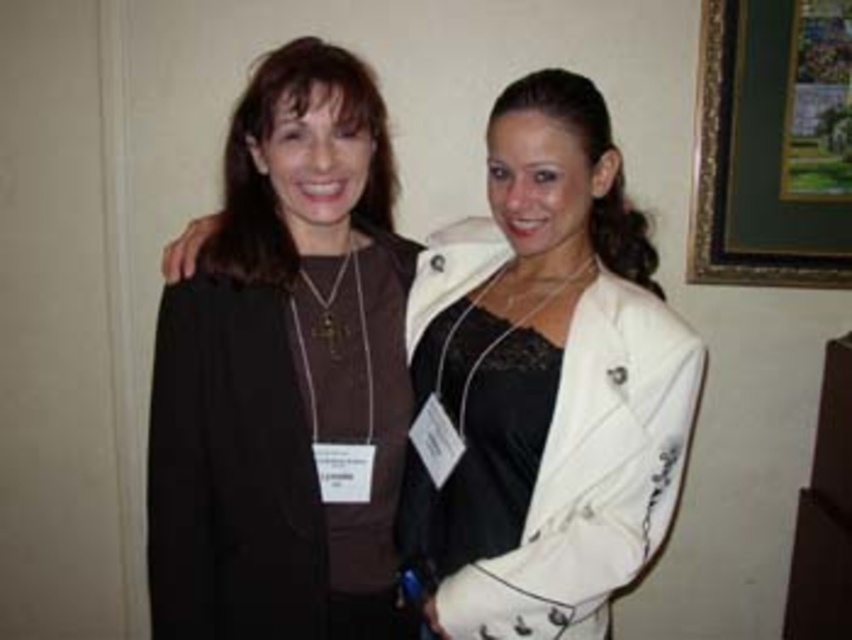
You are a photographer setting up a shoot and need to position a light to the left of both the matte brown sweater at center and the black lace dress at center. Based on their positions, which item should the light be placed to the left of first?

The light should be placed to the left of the black lace dress at center first because the matte brown sweater at center is to the right of the black lace dress at center, meaning the dress is on the left side relative to the sweater.

You are standing in front of the two women in the image, and you want to take a photo of them. The camera you are using has a minimum focusing distance of 1.5 meters. Can you take a clear photo of the point at coordinate point (252,524) without moving closer?

The point at coordinate point (252,524) is 1.48 meters away from the camera, which is closer than the minimum focusing distance of 1.5 meters. Therefore, you cannot take a clear photo of that point without moving closer.